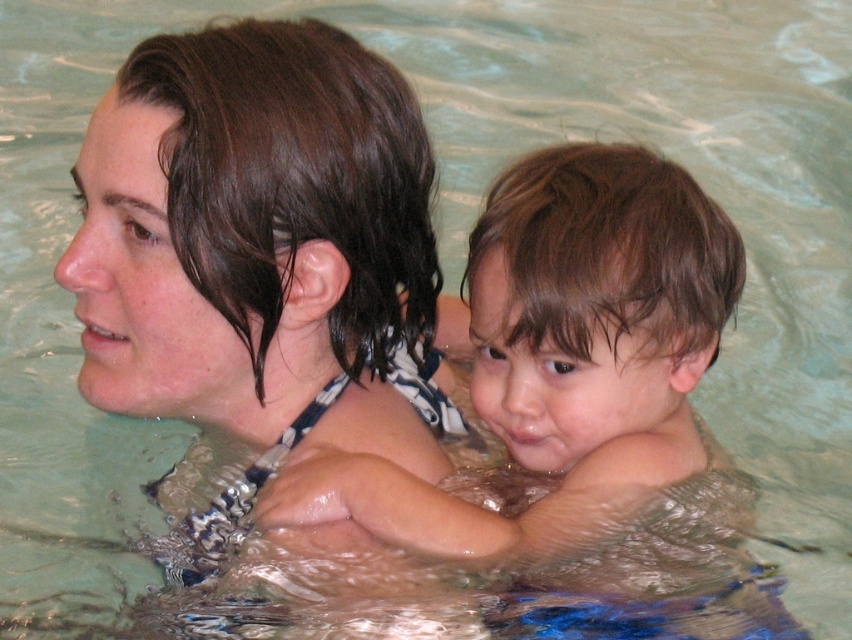
Is wet hair at upper left below wet skin child at center?

Actually, wet hair at upper left is above wet skin child at center.

Who is higher up, wet hair at upper left or wet skin child at center?

wet hair at upper left is above.

Who is more forward, (225, 342) or (441, 497)?

Point (225, 342) is in front.

The width and height of the screenshot is (852, 640). Find the location of `wet hair at upper left`. wet hair at upper left is located at coordinates (262, 257).